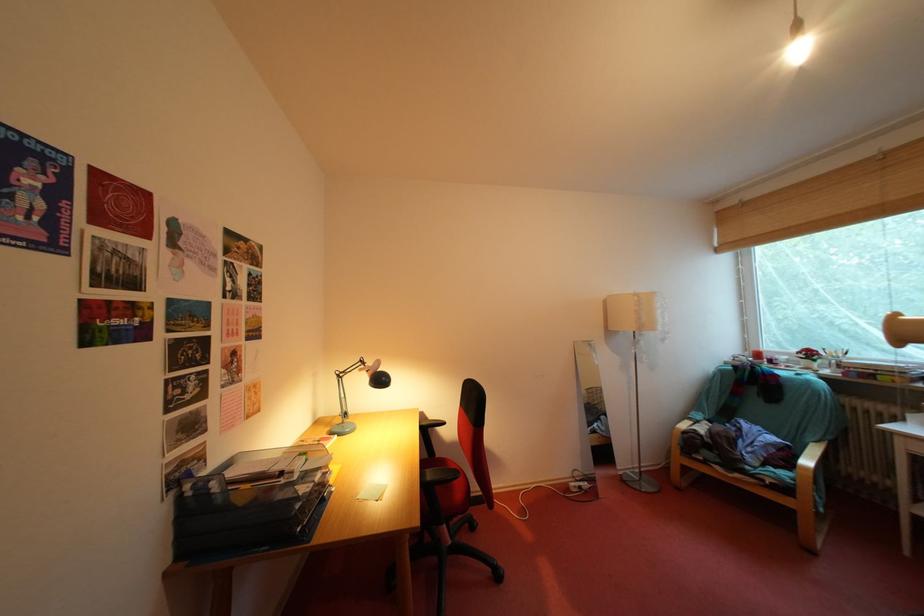
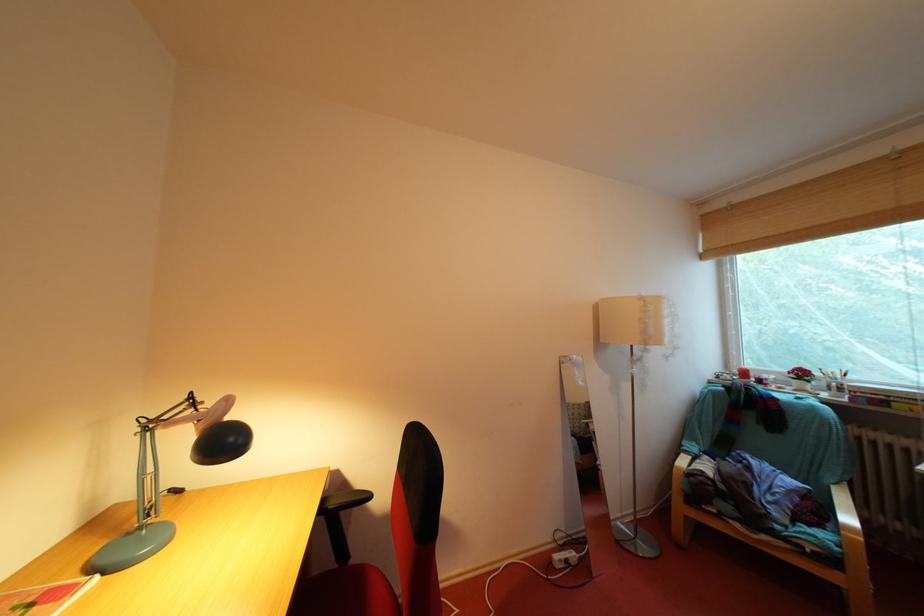
In the second image, find the point that corresponds to point 817,474 in the first image.

(861, 535)